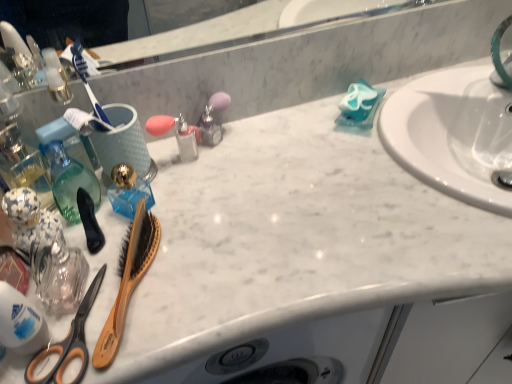
I want to click on vacant space in between blue matte soap at upper right, the second cleaning product from the bottom, and translucent blue glass at center, so click(260, 157).